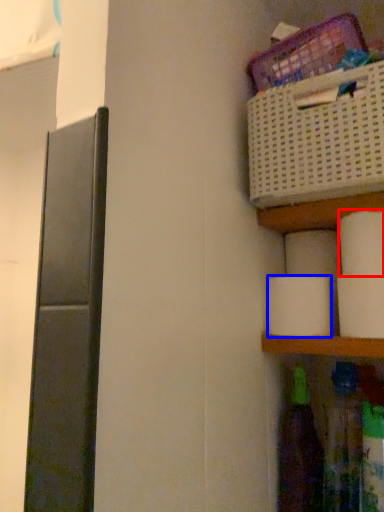
Question: Among these objects, which one is nearest to the camera, toilet paper (highlighted by a red box) or toilet paper (highlighted by a blue box)?

Choices:
 (A) toilet paper
 (B) toilet paper

Answer: (A)